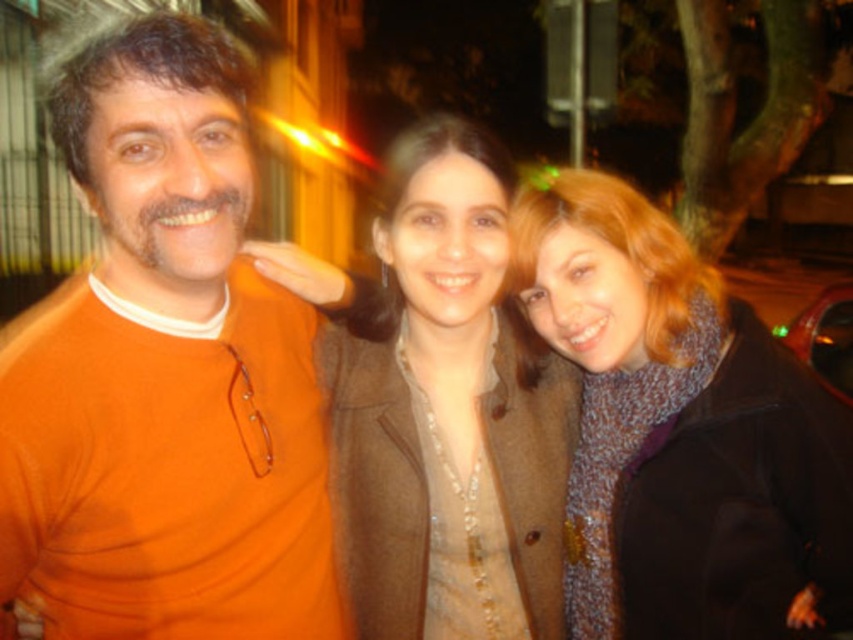
You are a photographer trying to capture a closeup of the knitted scarf at center and the brown woolen coat at center in the image. Since the camera can only focus on one object at a time, which object should you choose to ensure the thinner one is in focus?

The knitted scarf at center is thinner than the brown woolen coat at center, so you should focus on the knitted scarf at center to ensure the thinner one is in focus.

You are a photographer trying to adjust the lighting for a group photo. You notice the orange matte sweater at left and the brown woolen coat at center. Which object is positioned higher in the image?

The orange matte sweater at left is positioned higher in the image than the brown woolen coat at center.

You are a photographer trying to adjust the lighting for a group photo. You notice the knitted scarf at center and the brown woolen coat at center. Which one is located to the right of the other?

The knitted scarf at center is positioned on the right side of brown woolen coat at center.